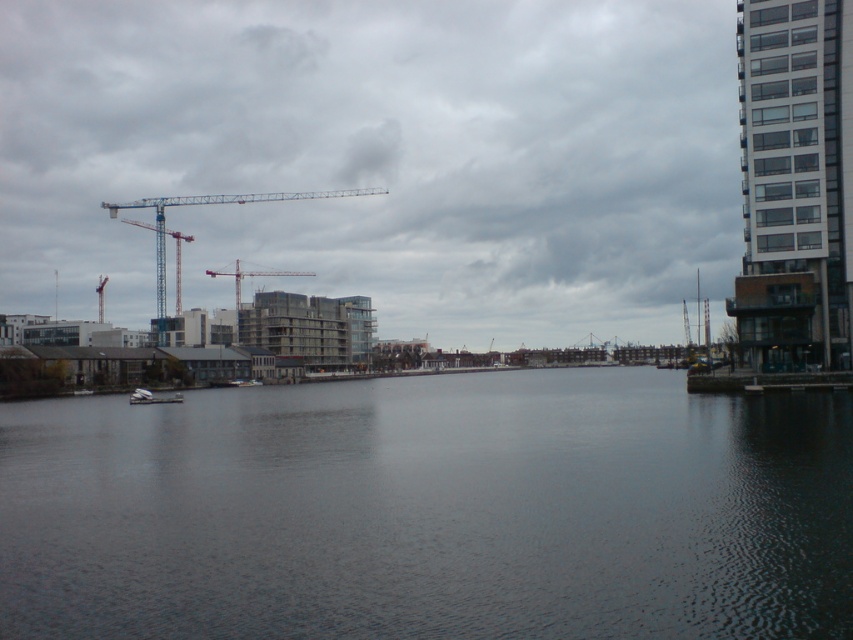
You are a boat operator who needs to navigate a white matte boat at center through the river. The safety regulations require a minimum distance of 30 meters between the boat and any obstacles. Given that the dark gray water at center is an obstacle, is the current distance sufficient?

The dark gray water at center and white matte boat at center are 32.19 meters apart. Since the required minimum distance is 30 meters, the current distance of 32.19 meters meets the safety regulations, so it is sufficient.